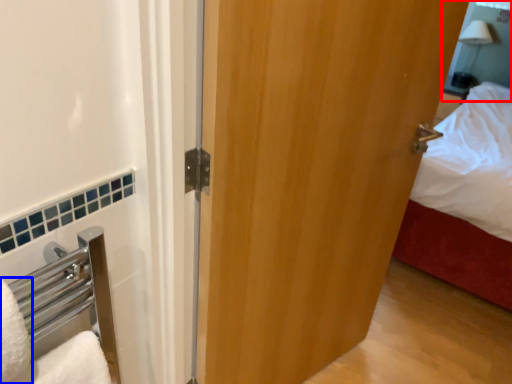
Question: Among these objects, which one is farthest to the camera, mirror (highlighted by a red box) or bath towel (highlighted by a blue box)?

Choices:
 (A) mirror
 (B) bath towel

Answer: (A)